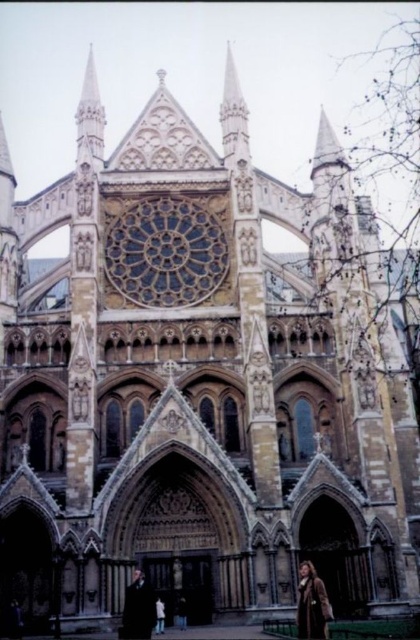
Question: In this image, where is smooth white spire at upper left located relative to brown leather coat at lower right?

Choices:
 (A) right
 (B) left

Answer: (B)

Question: Does smooth white spire at upper left appear over brown leather coat at lower right?

Choices:
 (A) no
 (B) yes

Answer: (B)

Question: Is smooth white spire at upper left below brown leather coat at lower right?

Choices:
 (A) yes
 (B) no

Answer: (B)

Question: Which of the following is the farthest from the observer?

Choices:
 (A) smooth white spire at upper left
 (B) brown leather coat at lower right

Answer: (A)